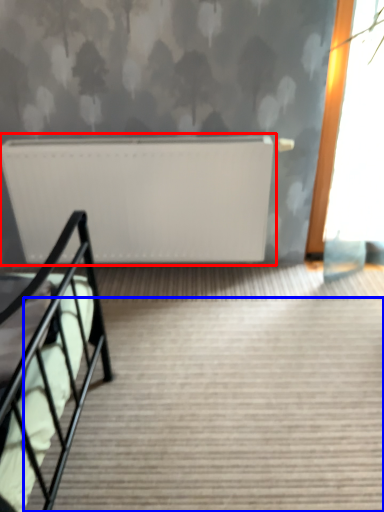
Question: Which point is closer to the camera, radiator (highlighted by a red box) or stairs (highlighted by a blue box)?

Choices:
 (A) radiator
 (B) stairs

Answer: (B)